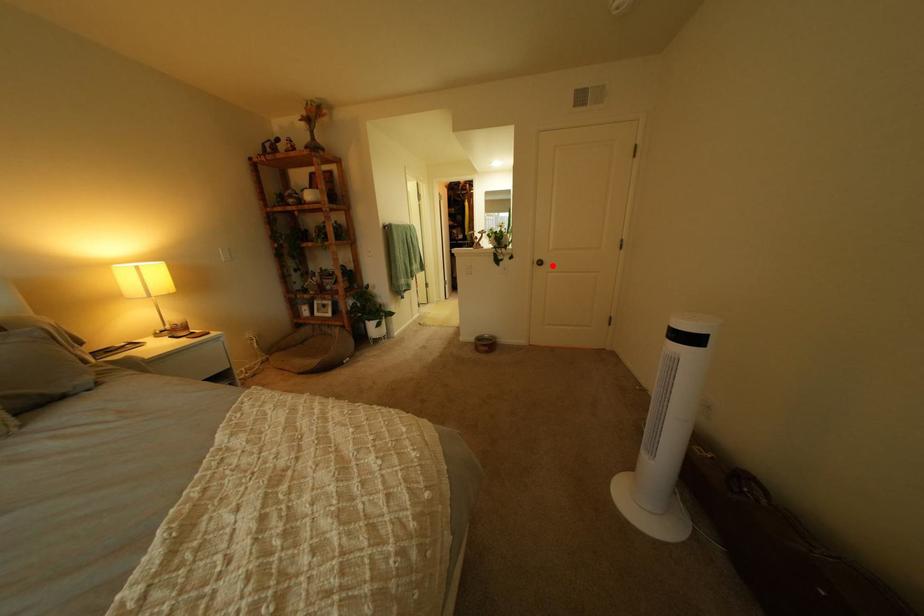
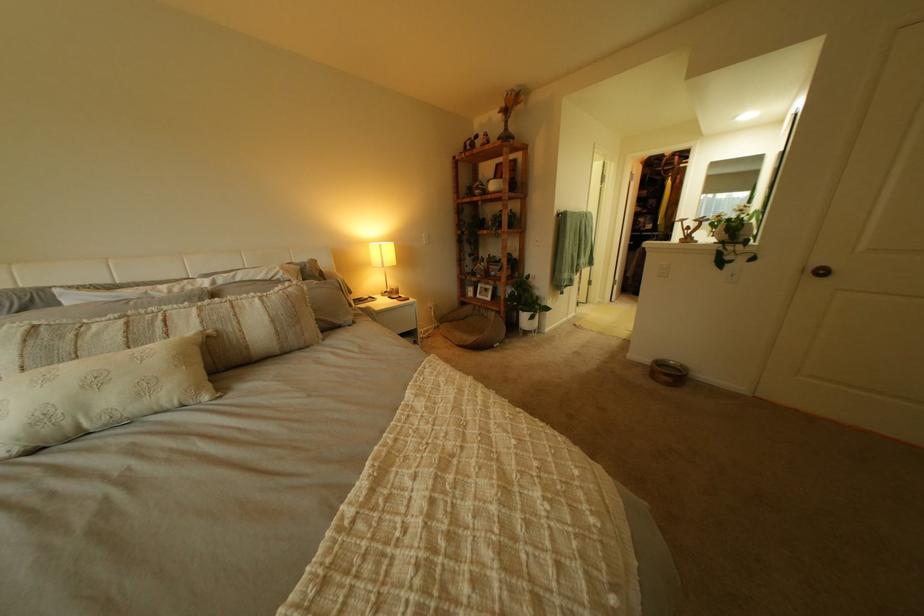
The point at the highlighted location is marked in the first image. Where is the corresponding point in the second image?

(825, 276)